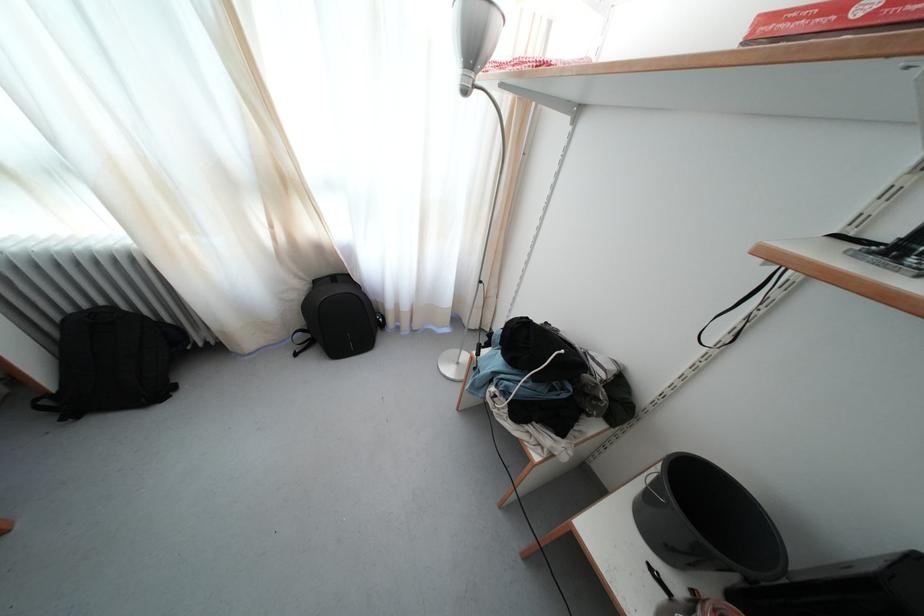
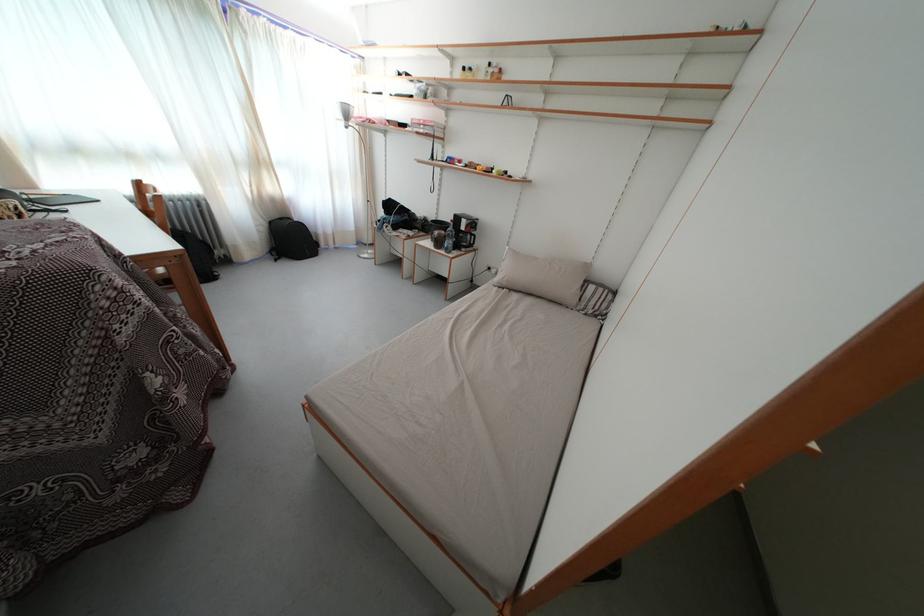
Where in the second image is the point corresponding to pixel 306 293 from the first image?

(272, 230)